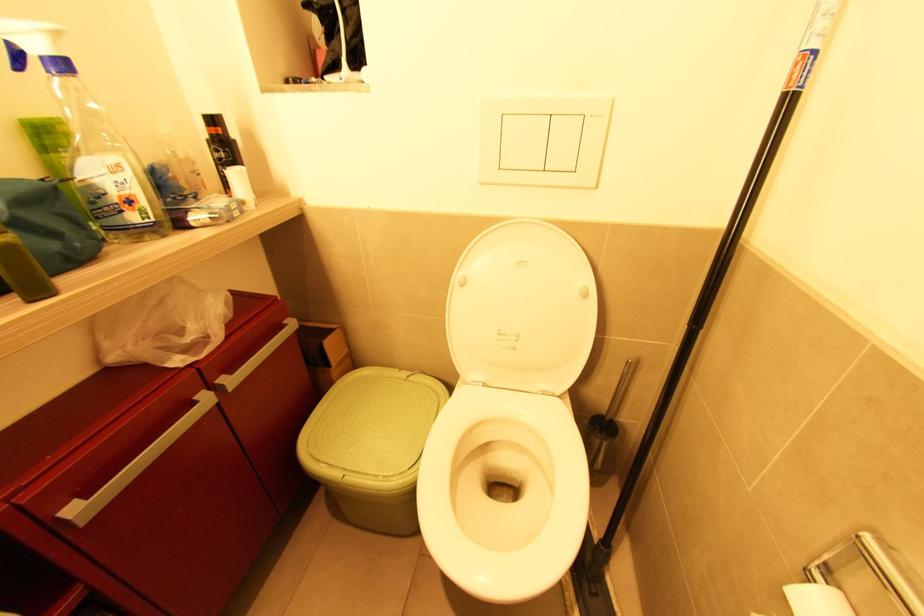
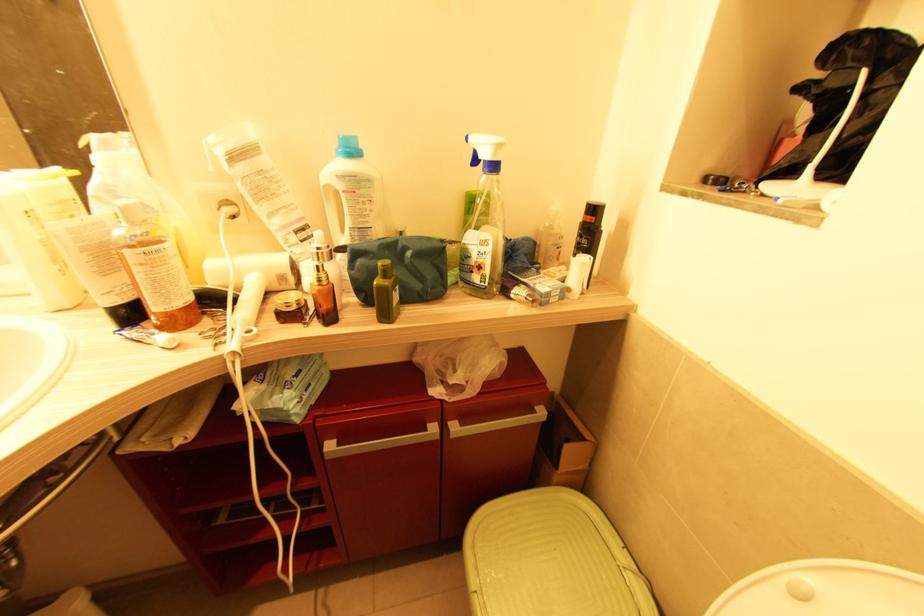
Where in the second image is the point corresponding to (x=409, y=378) from the first image?

(626, 570)